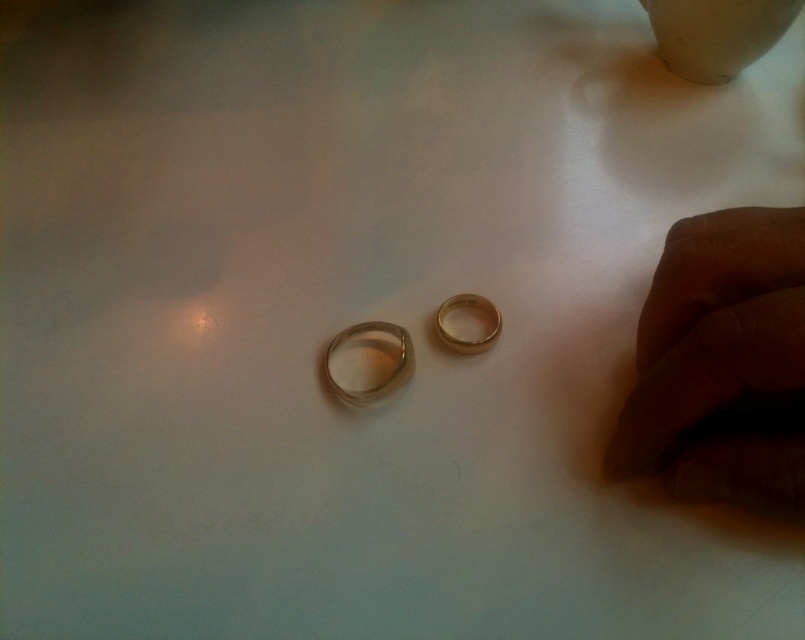
Question: Is matte gold ring at center below gold shiny ring at center?

Choices:
 (A) yes
 (B) no

Answer: (A)

Question: Which point appears closest to the camera in this image?

Choices:
 (A) (409, 342)
 (B) (617, 451)
 (C) (498, 323)

Answer: (B)

Question: Which point is farther to the camera?

Choices:
 (A) polished gold ring at center
 (B) matte gold ring at center

Answer: (A)

Question: Which is nearer to the polished gold ring at center?

Choices:
 (A) matte gold ring at center
 (B) gold shiny ring at center

Answer: (B)

Question: Does matte gold ring at center have a lesser width compared to gold shiny ring at center?

Choices:
 (A) yes
 (B) no

Answer: (B)

Question: From the image, what is the correct spatial relationship of matte gold ring at center in relation to gold shiny ring at center?

Choices:
 (A) below
 (B) above

Answer: (A)